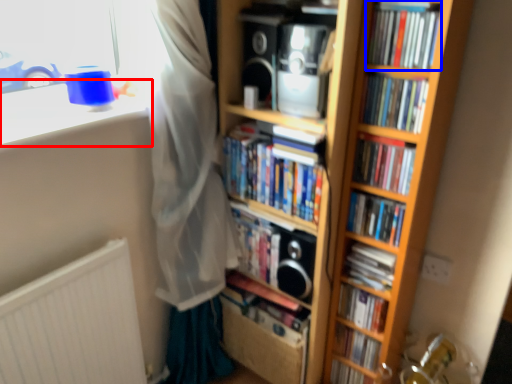
Question: Which point is further to the camera, window sill (highlighted by a red box) or book (highlighted by a blue box)?

Choices:
 (A) window sill
 (B) book

Answer: (B)